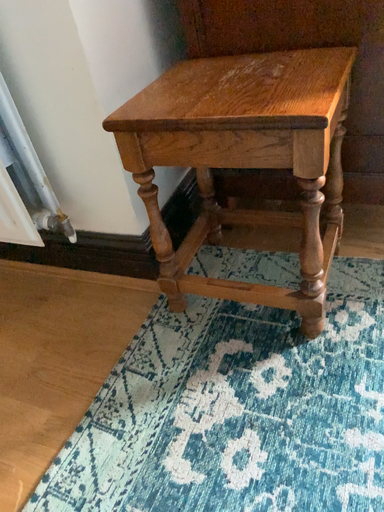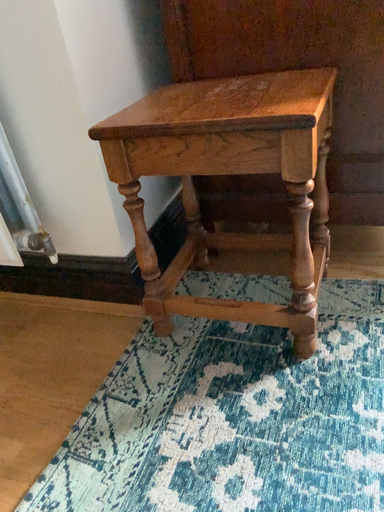
Question: Which way did the camera rotate in the video?

Choices:
 (A) rotated downward
 (B) rotated upward

Answer: (B)